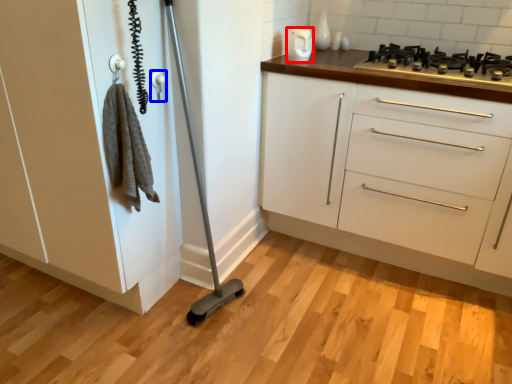
Question: Which point is closer to the camera, appliance (highlighted by a red box) or door handle (highlighted by a blue box)?

Choices:
 (A) appliance
 (B) door handle

Answer: (B)